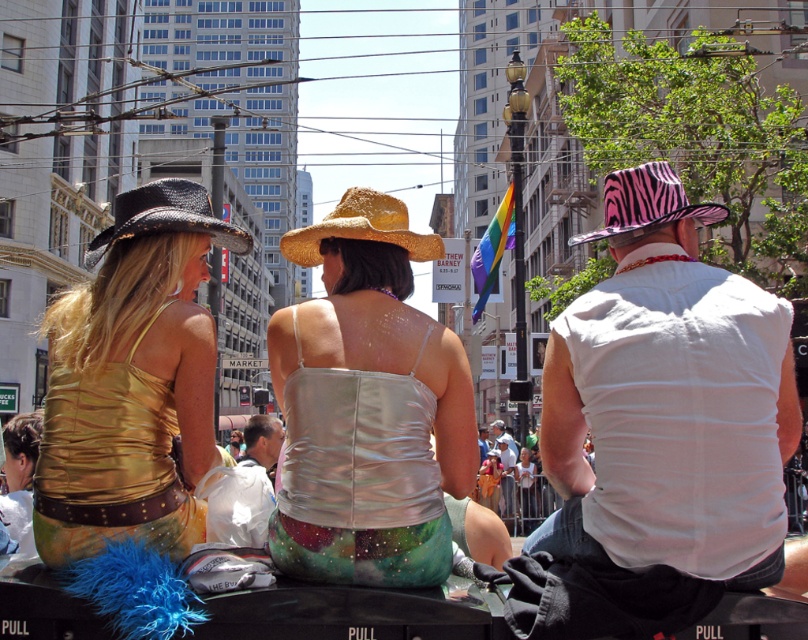
Question: Can you confirm if black woven cowboy hat at left is wider than straw hat at center?

Choices:
 (A) yes
 (B) no

Answer: (A)

Question: Among these points, which one is nearest to the camera?

Choices:
 (A) (297, 340)
 (B) (208, 422)

Answer: (A)

Question: From the image, what is the correct spatial relationship of white plastic bag at center in relation to pink zebra print cowboy hat at upper right?

Choices:
 (A) left
 (B) right

Answer: (A)

Question: Among these objects, which one is farthest from the camera?

Choices:
 (A) shiny gold tank top at center
 (B) shiny silver tank top at center
 (C) gold shiny tank top at upper left
 (D) white plastic bag at center

Answer: (B)

Question: Is white plastic bag at center to the right of shiny gold tank top at center from the viewer's perspective?

Choices:
 (A) yes
 (B) no

Answer: (A)

Question: Which object is positioned closest to the white cotton shirt at center?

Choices:
 (A) white plastic bag at center
 (B) gold shiny tank top at upper left
 (C) black woven cowboy hat at left

Answer: (C)